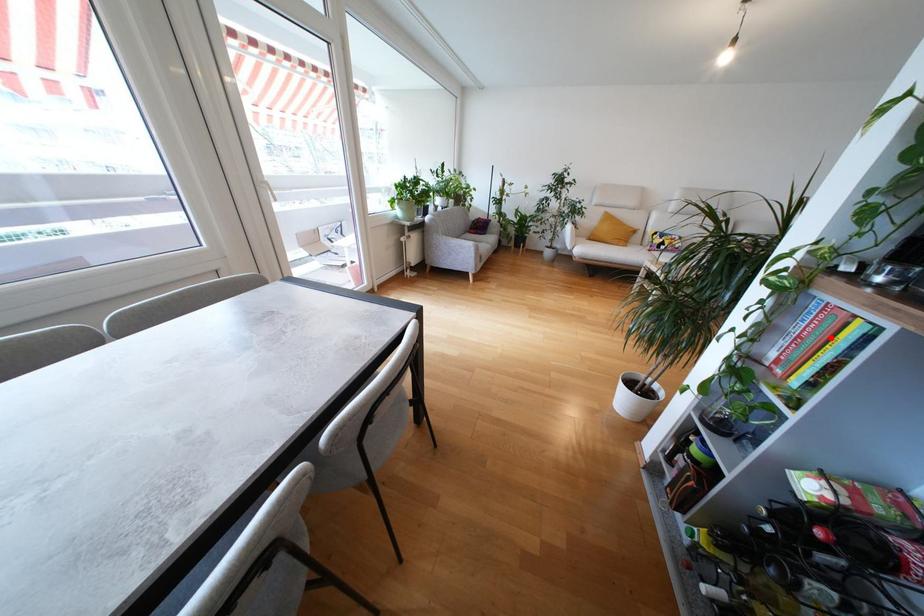
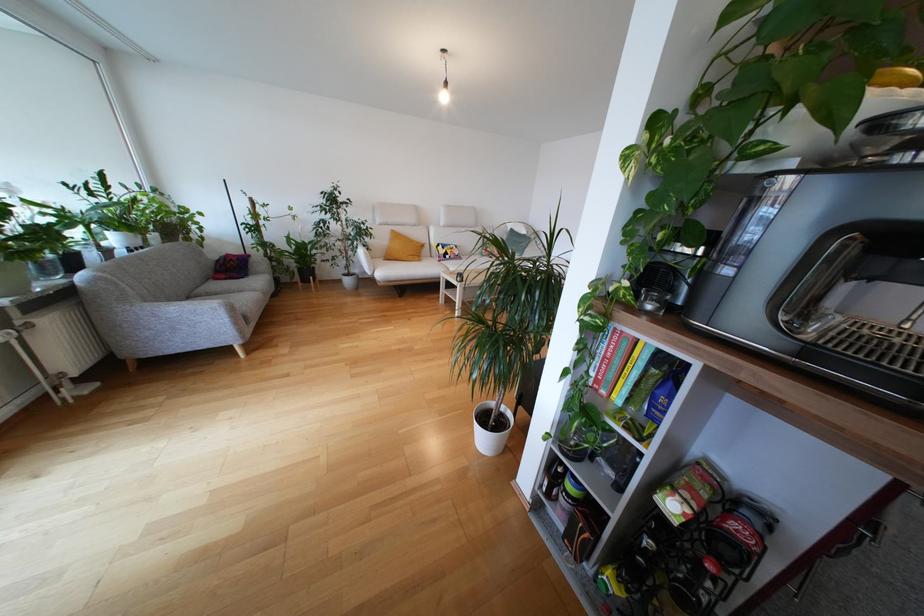
Question: I am providing you with two images of the same scene from different viewpoints. Image1 has a red point marked. In image2, the corresponding 3D location appears at what relative position? Reply with the corresponding letter.

Choices:
 (A) Closer
 (B) Farther

Answer: (A)